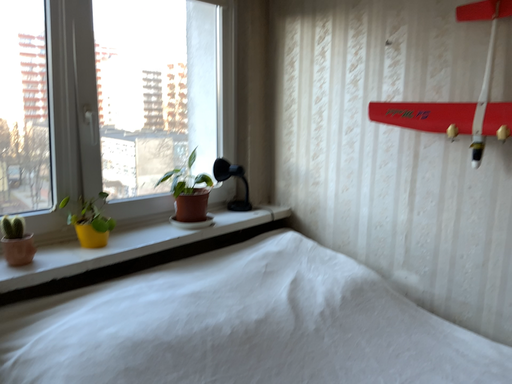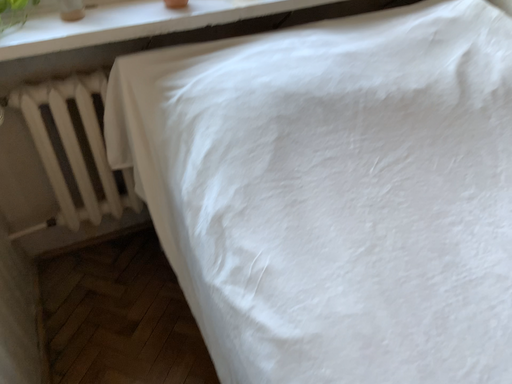
Question: Which way did the camera rotate in the video?

Choices:
 (A) rotated upward
 (B) rotated downward

Answer: (B)